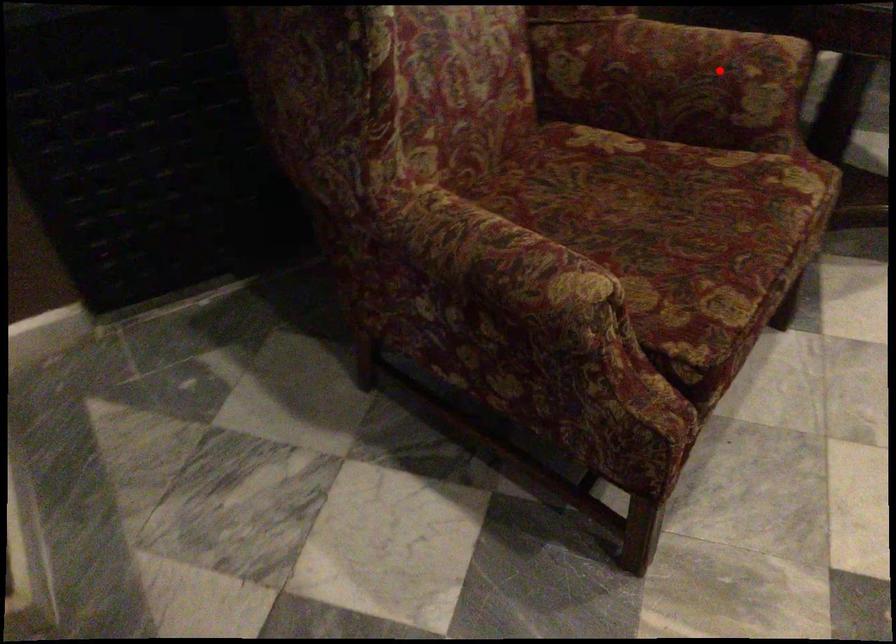
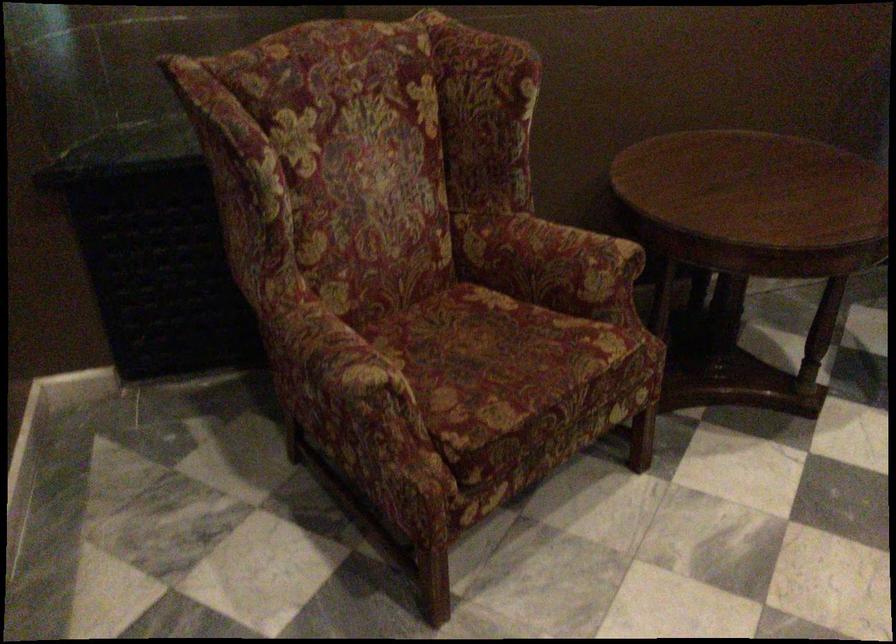
In the second image, find the point that corresponds to the highlighted location in the first image.

(572, 256)